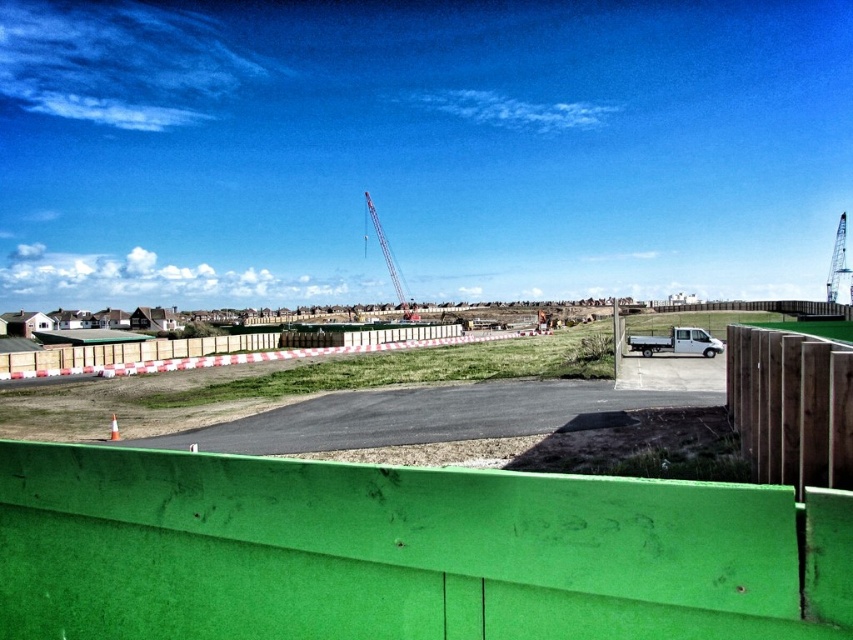
You are an inspector at the construction site. You need to determine which crane is taller between the metallic gray crane at upper right and the metallic silver crane at center. Based on the scene, which one is taller?

The metallic gray crane at upper right is not as tall as the metallic silver crane at center, so the metallic silver crane at center is taller.

You are a construction worker standing at the edge of the construction site. You need to place a 36 inch long safety sign on the closest object to you. The available objects are the green painted wood at lower center. Can you fit the safety sign on the closest object without exceeding its length?

The green painted wood at lower center is 33.48 inches from viewer. Since the safety sign is 36 inches long, which is longer than the object, it won